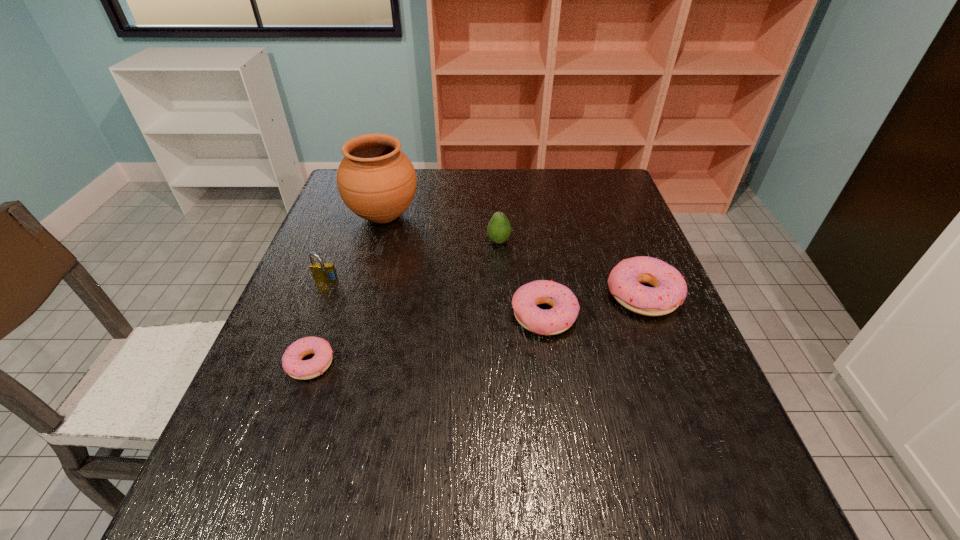
Locate an element on the screen. The width and height of the screenshot is (960, 540). free space between the second shortest doughnut and the nearest doughnut is located at coordinates (427, 340).

At what (x,y) coordinates should I click in order to perform the action: click on vacant space that is in between the nearest doughnut and the pottery. Please return your answer as a coordinate pair (x, y). The width and height of the screenshot is (960, 540). Looking at the image, I should click on (347, 289).

At what (x,y) coordinates should I click in order to perform the action: click on vacant space in between the padlock and the fifth tallest object. Please return your answer as a coordinate pair (x, y). Looking at the image, I should click on (435, 299).

Find the location of a particular element. free space between the rightmost object and the pottery is located at coordinates (514, 256).

In order to click on free space between the shortest doughnut and the fifth tallest object in this screenshot , I will do tap(427, 340).

Identify the location of vacant space that's between the avocado and the nearest doughnut. (404, 302).

Identify which object is the fourth closest to the rightmost doughnut. Please provide its 2D coordinates. Your answer should be formatted as a tuple, i.e. [(x, y)], where the tuple contains the x and y coordinates of a point satisfying the conditions above.

[(292, 363)]

Locate an element on the screen. Image resolution: width=960 pixels, height=540 pixels. object that is the fourth closest to the leftmost doughnut is located at coordinates (498, 229).

Identify which doughnut is the nearest to the rightmost object. Please provide its 2D coordinates. Your answer should be formatted as a tuple, i.e. [(x, y)], where the tuple contains the x and y coordinates of a point satisfying the conditions above.

[(558, 319)]

Locate an element on the screen. doughnut that is the second closest one to the padlock is located at coordinates (558, 319).